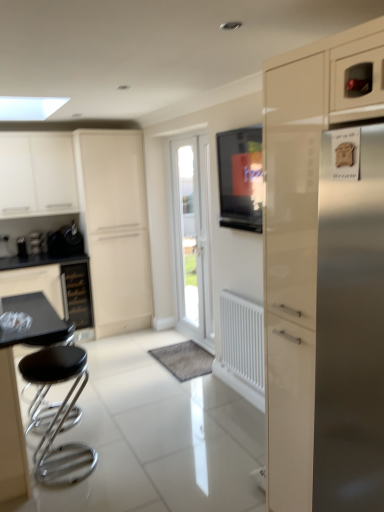
Question: In terms of width, does black glass drawer at lower left look wider or thinner when compared to metallic black kettle at left?

Choices:
 (A) wide
 (B) thin

Answer: (A)

Question: From the image's perspective, is black glass drawer at lower left located above or below metallic black kettle at left?

Choices:
 (A) above
 (B) below

Answer: (B)

Question: Which is farther from the black leather stool at lower left?

Choices:
 (A) satin black coffee machine at left
 (B) white plastic radiator at center
 (C) white glossy cabinet at center
 (D) glossy cream cabinet at right, arranged as the 1th cabinetry when viewed from the right
 (E) white glossy door at center

Answer: (A)

Question: Estimate the real-world distances between objects in this image. Which object is closer to the white glossy cabinet at upper left, marked as the first cabinetry in a left-to-right arrangement?

Choices:
 (A) matte black tv at center
 (B) white glossy door at center
 (C) metallic black kettle at left
 (D) white plastic radiator at center
 (E) black leather stool at lower left

Answer: (C)